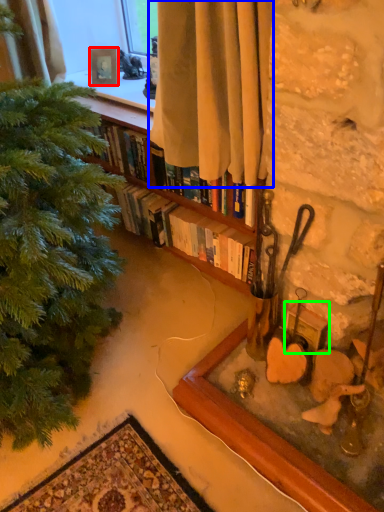
Question: Considering the real-world distances, which object is farthest from picture frame (highlighted by a red box)? curtain (highlighted by a blue box) or picture frame (highlighted by a green box)?

Choices:
 (A) curtain
 (B) picture frame

Answer: (B)